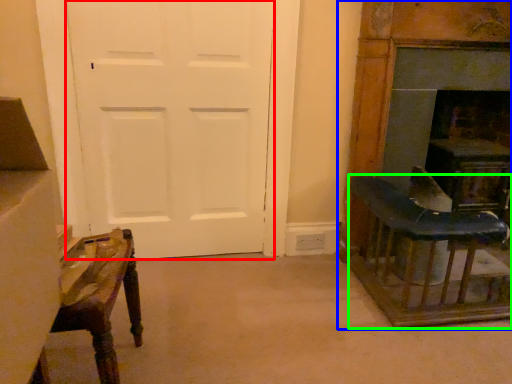
Question: Estimate the real-world distances between objects in this image. Which object is farther from screen door (highlighted by a red box), furniture (highlighted by a blue box) or table (highlighted by a green box)?

Choices:
 (A) furniture
 (B) table

Answer: (B)